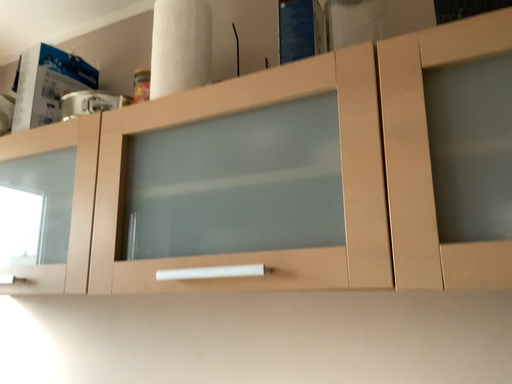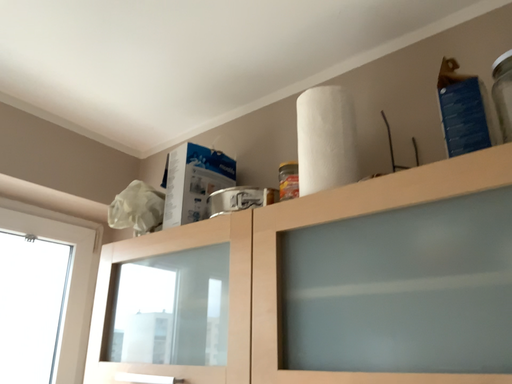
Question: Which way did the camera rotate in the video?

Choices:
 (A) rotated right
 (B) rotated left

Answer: (B)